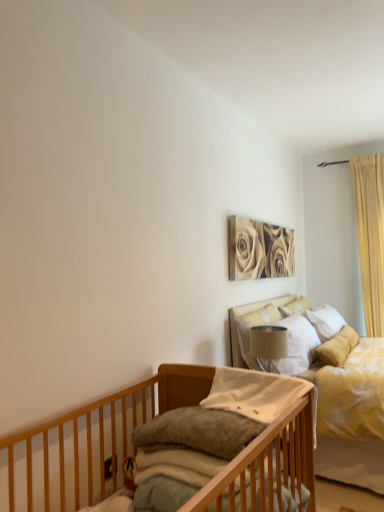
Question: Can we say white soft pillow at upper right, marked as the 1th pillow in a right-to-left arrangement, lies outside satin white pillow at upper center, positioned as the 2th pillow in left-to-right order?

Choices:
 (A) yes
 (B) no

Answer: (A)

Question: Is white soft pillow at upper right, the first pillow in the back-to-front sequence, far away from satin white pillow at upper center, which is counted as the second pillow, starting from the back?

Choices:
 (A) yes
 (B) no

Answer: (B)

Question: Does white soft pillow at upper right, the first pillow in the back-to-front sequence, have a greater width compared to satin white pillow at upper center, positioned as the 2th pillow in left-to-right order?

Choices:
 (A) no
 (B) yes

Answer: (B)

Question: Is white soft pillow at upper right, which is the 3th pillow in front-to-back order, smaller than satin white pillow at upper center, marked as the second pillow in a front-to-back arrangement?

Choices:
 (A) no
 (B) yes

Answer: (B)

Question: From the image's perspective, would you say white soft pillow at upper right, marked as the 1th pillow in a right-to-left arrangement, is shown under satin white pillow at upper center, marked as the 2th pillow in a right-to-left arrangement?

Choices:
 (A) no
 (B) yes

Answer: (A)

Question: Visually, is satin white pillow at upper center, positioned as the 2th pillow in left-to-right order, positioned to the left or to the right of sepia-toned canvas at upper center?

Choices:
 (A) left
 (B) right

Answer: (A)

Question: Is point (244, 328) closer or farther from the camera than point (258, 256)?

Choices:
 (A) closer
 (B) farther

Answer: (A)

Question: From a real-world perspective, is satin white pillow at upper center, marked as the second pillow in a front-to-back arrangement, above or below sepia-toned canvas at upper center?

Choices:
 (A) above
 (B) below

Answer: (B)

Question: Choose the correct answer: Is satin white pillow at upper center, marked as the second pillow in a front-to-back arrangement, inside sepia-toned canvas at upper center or outside it?

Choices:
 (A) inside
 (B) outside

Answer: (B)

Question: Considering the relative positions of white soft pillow at upper right, which is the 3th pillow in front-to-back order, and yellow fabric curtain at right in the image provided, is white soft pillow at upper right, which is the 3th pillow in front-to-back order, to the left or to the right of yellow fabric curtain at right?

Choices:
 (A) left
 (B) right

Answer: (A)

Question: From the image's perspective, is white soft pillow at upper right, which is the 3th pillow in front-to-back order, above or below yellow fabric curtain at right?

Choices:
 (A) above
 (B) below

Answer: (B)

Question: Is white soft pillow at upper right, marked as the 1th pillow in a right-to-left arrangement, taller or shorter than yellow fabric curtain at right?

Choices:
 (A) tall
 (B) short

Answer: (B)

Question: Is white soft pillow at upper right, the first pillow in the back-to-front sequence, spatially inside yellow fabric curtain at right, or outside of it?

Choices:
 (A) outside
 (B) inside

Answer: (A)

Question: In terms of width, does wooden crib at lower left look wider or thinner when compared to yellow fabric curtain at right?

Choices:
 (A) thin
 (B) wide

Answer: (B)

Question: Is wooden crib at lower left inside the boundaries of yellow fabric curtain at right, or outside?

Choices:
 (A) outside
 (B) inside

Answer: (A)